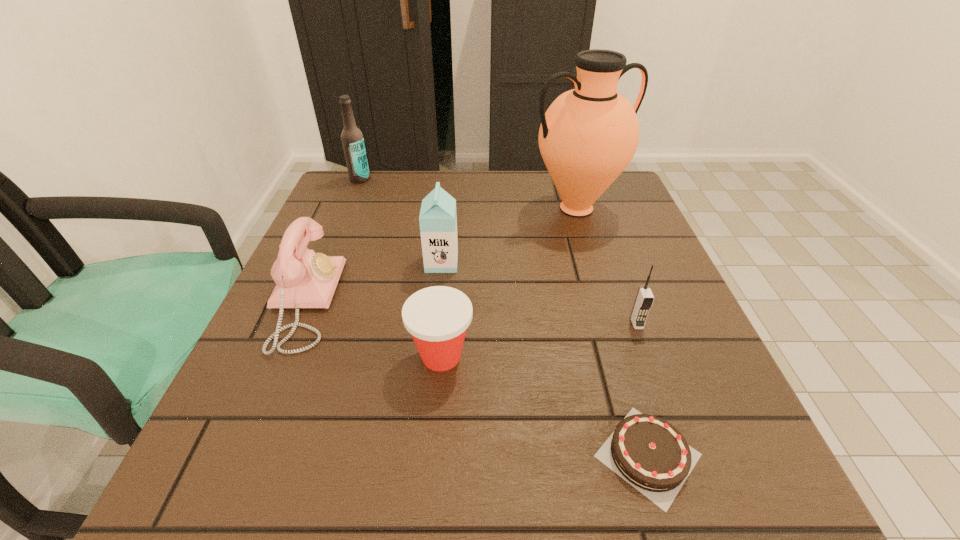
The width and height of the screenshot is (960, 540). In order to click on free space at the left edge in this screenshot , I will do `click(324, 421)`.

Identify the location of vacant point at the right edge. The height and width of the screenshot is (540, 960). (714, 397).

At what (x,y) coordinates should I click in order to perform the action: click on vacant point located between the chocolate cake and the telephone. Please return your answer as a coordinate pair (x, y). Looking at the image, I should click on (476, 379).

This screenshot has width=960, height=540. Find the location of `free space that is in between the shortest object and the fifth shortest object`. free space that is in between the shortest object and the fifth shortest object is located at coordinates (545, 359).

Locate an element on the screen. This screenshot has width=960, height=540. free space between the Dixie cup and the telephone is located at coordinates (372, 329).

The image size is (960, 540). Find the location of `free space between the shortest object and the Dixie cup`. free space between the shortest object and the Dixie cup is located at coordinates (544, 406).

Locate an element on the screen. The image size is (960, 540). free spot between the second tallest object and the sixth tallest object is located at coordinates pyautogui.click(x=400, y=267).

Image resolution: width=960 pixels, height=540 pixels. In order to click on free space between the milk carton and the chocolate cake in this screenshot , I will do `click(545, 359)`.

Identify the location of unoccupied position between the farthest object and the telephone. The image size is (960, 540). (332, 240).

Identify the location of vacant space that's between the nearest object and the milk carton. (545, 359).